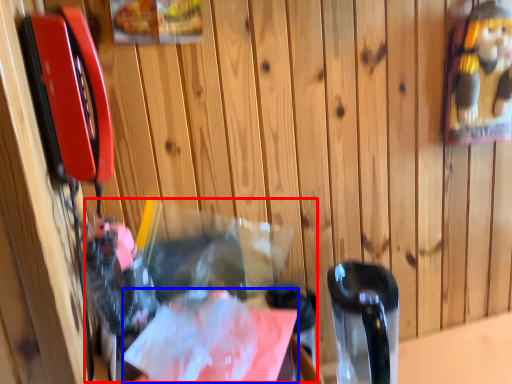
Question: Which point is further to the camera, waste (highlighted by a red box) or wrapping paper (highlighted by a blue box)?

Choices:
 (A) waste
 (B) wrapping paper

Answer: (B)